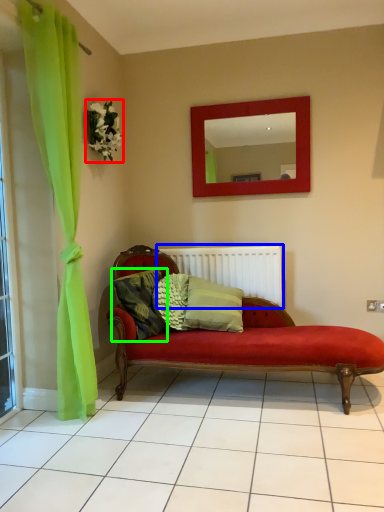
Question: Considering the real-world distances, which object is farthest from flower (highlighted by a red box)? radiator (highlighted by a blue box) or pillow (highlighted by a green box)?

Choices:
 (A) radiator
 (B) pillow

Answer: (A)